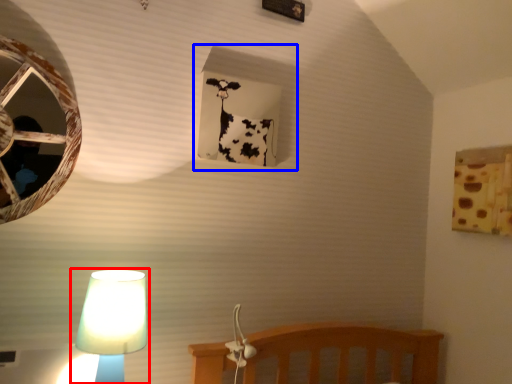
Question: Which of the following is the farthest to the observer, lamp (highlighted by a red box) or window frame (highlighted by a blue box)?

Choices:
 (A) lamp
 (B) window frame

Answer: (B)